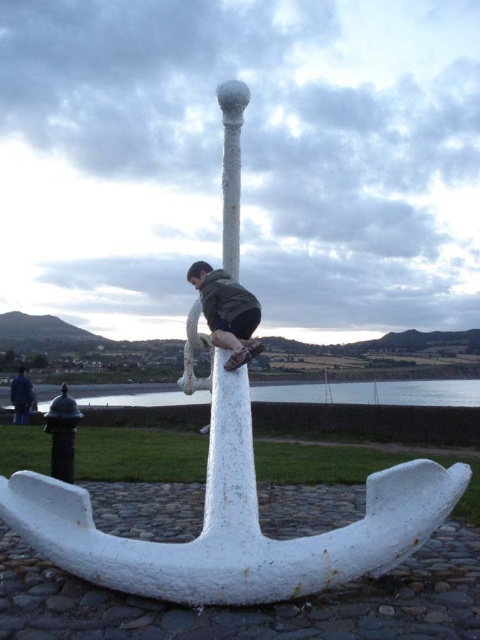
You are standing near the anchor and want to place a small object on the clear water at anchor center. To do this, you need to move it from the dark gray fabric jacket at center. In which direction should you move the object?

The clear water at anchor center is to the right of the dark gray fabric jacket at center, so you should move the object to the right to place it on the clear water at anchor center.

You are a photographer trying to capture the scene of the anchor and the person. You want to place your camera at the origin point to take a photo. According to the coordinates provided, where should you position your camera relative to the dark gray fabric jacket at center?

The dark gray fabric jacket at center is located at coordinates point (228, 312). To position the camera at the origin point, you should place it to the left and below the dark gray fabric jacket at center since the origin point is typically at the bottom left corner of the image, and the coordinates increase towards the right and top.

You are a fashion designer observing two jackets in the scene. The jackets are labeled as dark gray fabric jacket at center and blue fabric jacket at lower left. Which jacket has a more slender silhouette?

The dark gray fabric jacket at center is thinner than the blue fabric jacket at lower left, so the dark gray fabric jacket at center has a more slender silhouette.